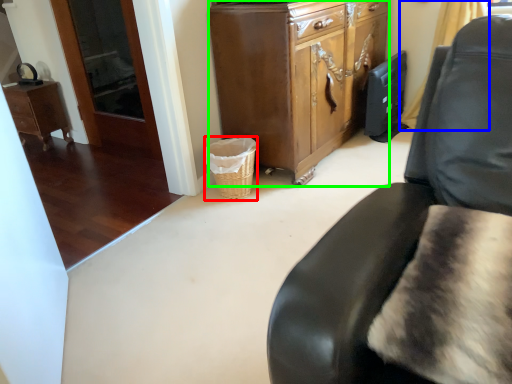
Question: Which object is the closest to the basket (highlighted by a red box)? Choose among these: curtain (highlighted by a blue box) or cabinetry (highlighted by a green box).

Choices:
 (A) curtain
 (B) cabinetry

Answer: (B)